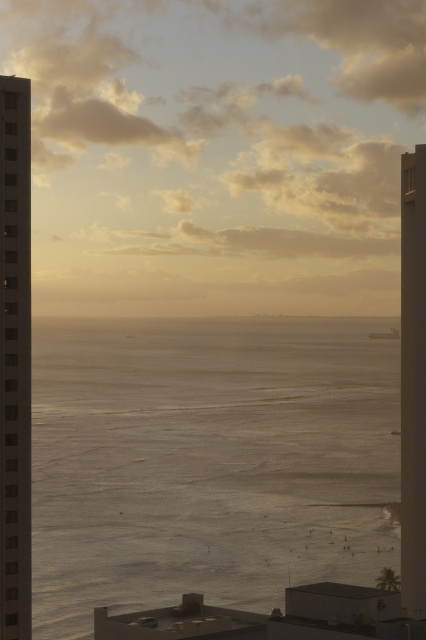
You are a drone operator tasked with flying a drone between the smooth concrete tower at left and the smooth glass tower at right. The drone has a wingspan of 1.5 meters. Can the drone safely navigate the space between them?

The distance between the smooth concrete tower at left and the smooth glass tower at right is 168.35 meters, so yes, the drone can safely navigate the space between them since the distance is much larger than the drone wingspan of 1.5 meters.

You are a photographer planning to capture the golden water at center and the smooth glass tower at right in a single shot. Based on their heights, which object will appear larger in the photo?

The smooth glass tower at right will appear larger in the photo because it is taller than the golden water at center.

You are standing at the origin point of the coordinate system. The golden water at center is at point (x=207, y=460). Which direction should you move to reach the golden water at center?

To reach the golden water at center located at point (x=207, y=460), you should move in the direction of increasing x and y coordinates since the coordinates are positive in both axes.